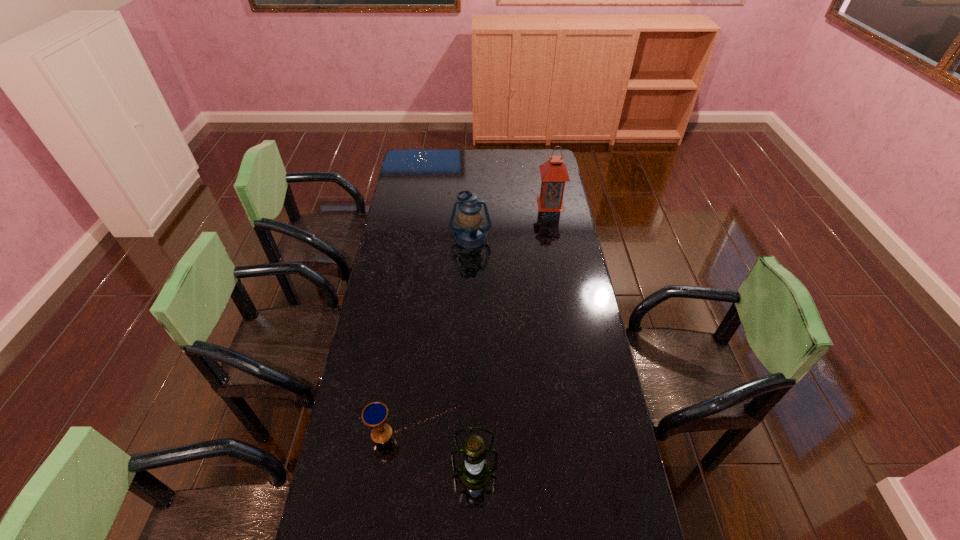
The image size is (960, 540). I want to click on free space between the second nearest lantern and the chalice, so click(x=426, y=335).

At what (x,y) coordinates should I click in order to perform the action: click on free space between the shortest lantern and the nearest object. Please return your answer as a coordinate pair (x, y). The width and height of the screenshot is (960, 540). Looking at the image, I should click on (472, 355).

Image resolution: width=960 pixels, height=540 pixels. I want to click on free space between the rightmost object and the shortest lantern, so click(511, 221).

The height and width of the screenshot is (540, 960). In order to click on free space between the chalice and the second shortest object in this screenshot , I will do `click(426, 335)`.

Locate an element on the screen. The image size is (960, 540). blank region between the nearest object and the farthest object is located at coordinates (513, 339).

Identify which object is located as the third nearest to the farthest object. Please provide its 2D coordinates. Your answer should be formatted as a tuple, i.e. [(x, y)], where the tuple contains the x and y coordinates of a point satisfying the conditions above.

[(474, 473)]

Select which object appears as the closest to the nearest lantern. Please provide its 2D coordinates. Your answer should be formatted as a tuple, i.e. [(x, y)], where the tuple contains the x and y coordinates of a point satisfying the conditions above.

[(375, 415)]

Select which lantern appears as the second closest to the third farthest object. Please provide its 2D coordinates. Your answer should be formatted as a tuple, i.e. [(x, y)], where the tuple contains the x and y coordinates of a point satisfying the conditions above.

[(470, 234)]

Identify the location of lantern that is the closest to the second farthest object. (554, 174).